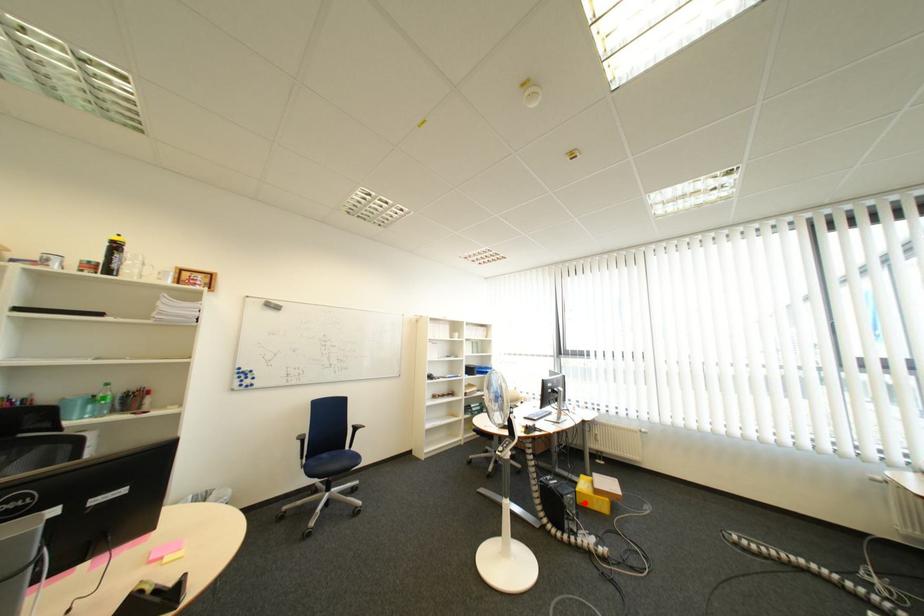
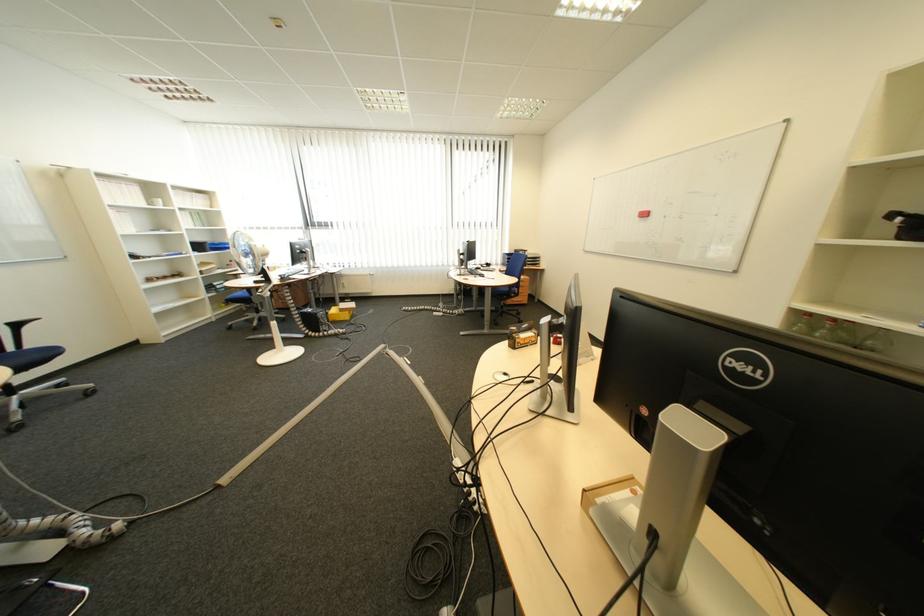
Question: I am providing you with two images of the same scene from different viewpoints. A red point is shown in image1. For the corresponding object point in image2, is it positioned nearer or farther from the camera?

Choices:
 (A) Nearer
 (B) Farther

Answer: (A)